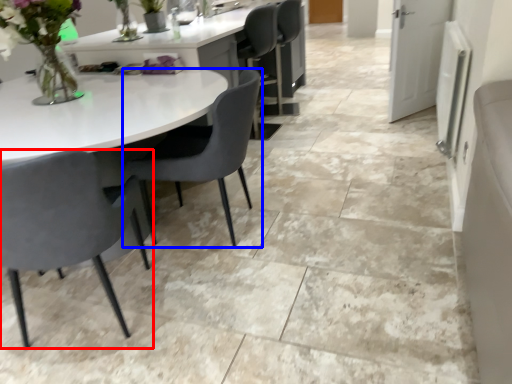
Question: Which object appears farthest to the camera in this image, chair (highlighted by a red box) or chair (highlighted by a blue box)?

Choices:
 (A) chair
 (B) chair

Answer: (B)